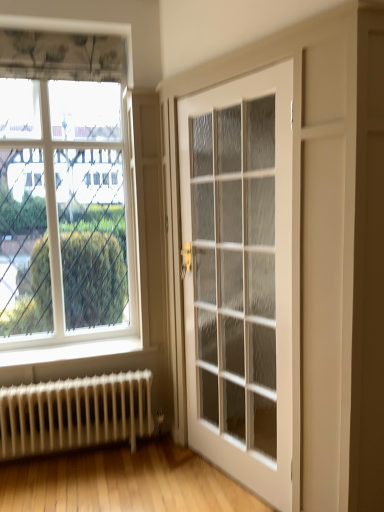
Image resolution: width=384 pixels, height=512 pixels. In order to click on vacant area that lies in front of white metal radiator at lower left in this screenshot , I will do `click(74, 486)`.